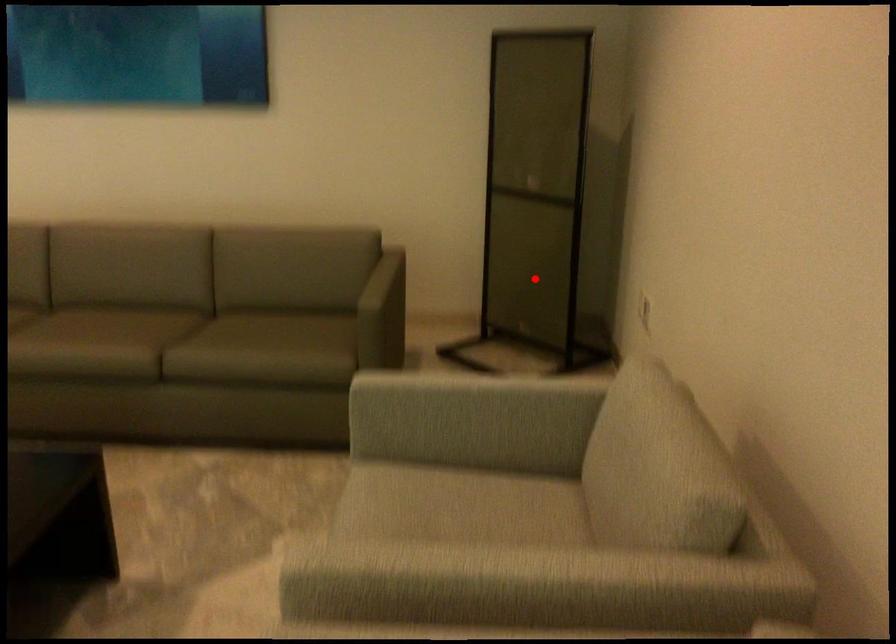
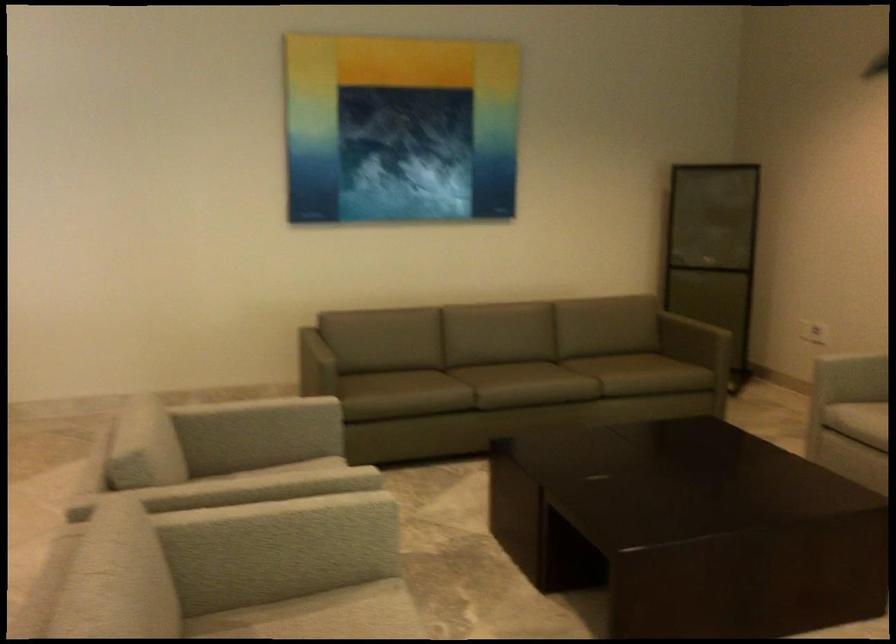
In the second image, find the point that corresponds to the highlighted location in the first image.

(713, 317)